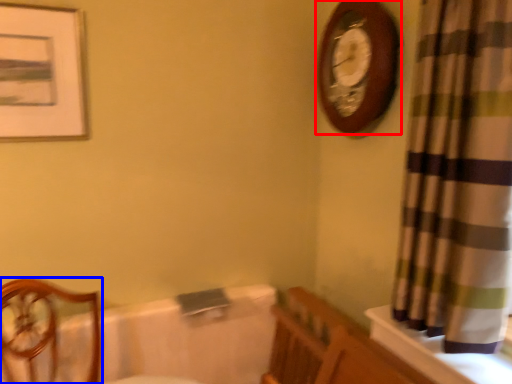
Question: Which of the following is the closest to the observer, wall clock (highlighted by a red box) or furniture (highlighted by a blue box)?

Choices:
 (A) wall clock
 (B) furniture

Answer: (B)